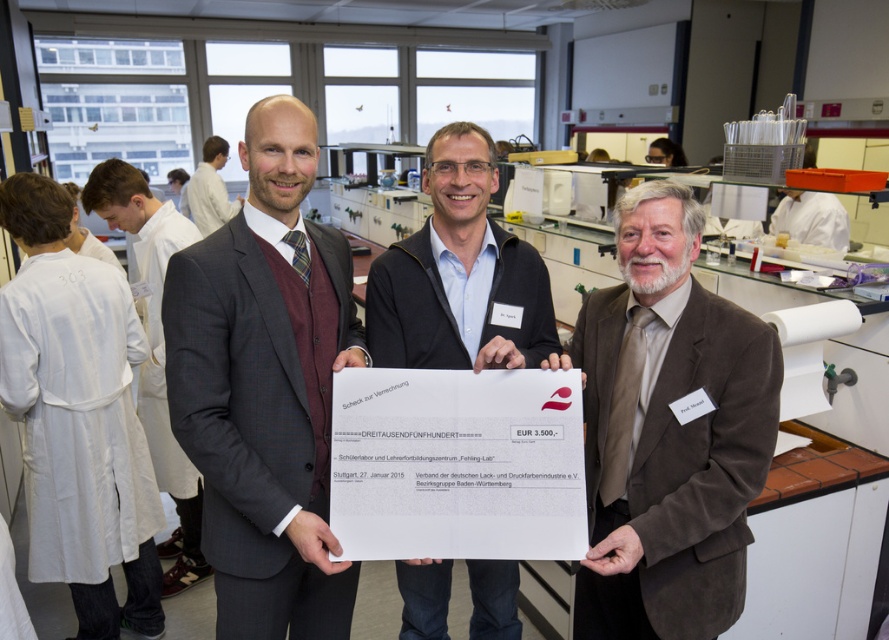
You are a photographer positioned to the left of the group. You need to capture a photo where both the white lab coat at left and the maroon sweater at center are clearly visible. Given their heights, which subject should you focus on to ensure both are in frame without cropping?

Since the white lab coat at left is taller than the maroon sweater at center, you should focus on the white lab coat at left to ensure both are in frame without cropping.

You are a photographer setting up for a group photo. You need to position the matte black suit at center and the maroon sweater at center so that both are visible in the frame. Given their height difference, which person should you place closer to the camera to ensure their faces are equally visible?

The maroon sweater at center should be placed closer to the camera since the matte black suit at center is taller. This adjustment will help balance their visibility in the photo.